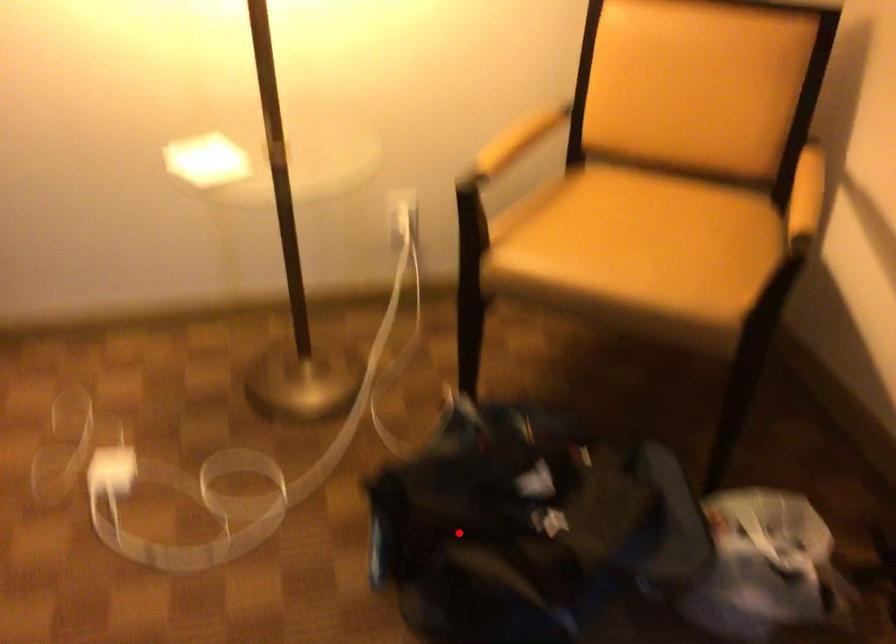
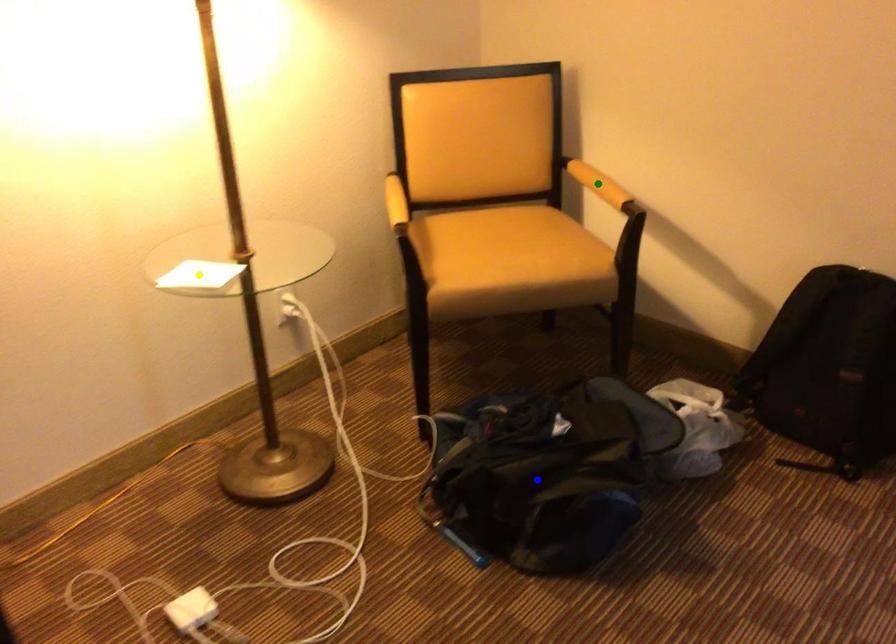
Question: I am providing you with two images of the same scene from different viewpoints. A red point is marked on the first image. You are given multiple points on the second image. Can you choose the point in image 2 that corresponds to the point in image 1?

Choices:
 (A) blue point
 (B) yellow point
 (C) green point

Answer: (A)